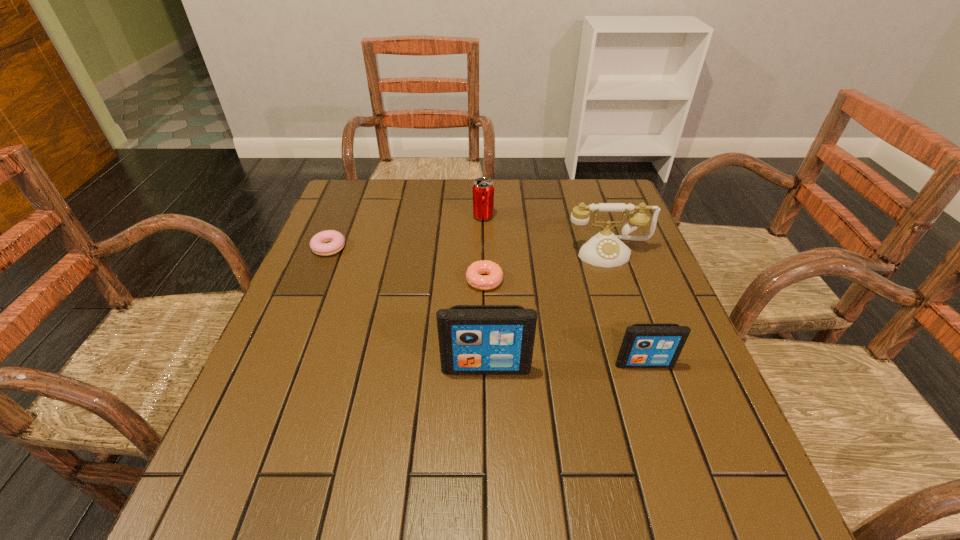
At what (x,y) coordinates should I click in order to perform the action: click on blank space located on the left of the soda can. Please return your answer as a coordinate pair (x, y). The image size is (960, 540). Looking at the image, I should click on (419, 217).

Locate an element on the screen. The width and height of the screenshot is (960, 540). free location located on the dial of the telephone is located at coordinates (636, 338).

You are a GUI agent. You are given a task and a screenshot of the screen. Output one action in this format:
    pyautogui.click(x=<x>, y=<y>)
    Task: Click on the free location located on the back of the nearer doughnut
    The width and height of the screenshot is (960, 540).
    Given the screenshot: What is the action you would take?
    pyautogui.click(x=484, y=219)

At what (x,y) coordinates should I click in order to perform the action: click on vacant region located on the back of the farther doughnut. Please return your answer as a coordinate pair (x, y). Looking at the image, I should click on (356, 182).

Identify the location of object that is at the far edge. (483, 188).

You are a GUI agent. You are given a task and a screenshot of the screen. Output one action in this format:
    pyautogui.click(x=<x>, y=<y>)
    Task: Click on the object that is positioned at the left edge
    
    Given the screenshot: What is the action you would take?
    pyautogui.click(x=337, y=241)

Image resolution: width=960 pixels, height=540 pixels. Find the location of `iPod that is at the right edge`. iPod that is at the right edge is located at coordinates (644, 345).

Where is `telephone situated at the right edge`? telephone situated at the right edge is located at coordinates (604, 249).

Where is `vacant space at the far edge of the desktop`? The height and width of the screenshot is (540, 960). vacant space at the far edge of the desktop is located at coordinates [x=438, y=209].

The width and height of the screenshot is (960, 540). In order to click on free space at the near edge of the desktop in this screenshot , I will do `click(418, 458)`.